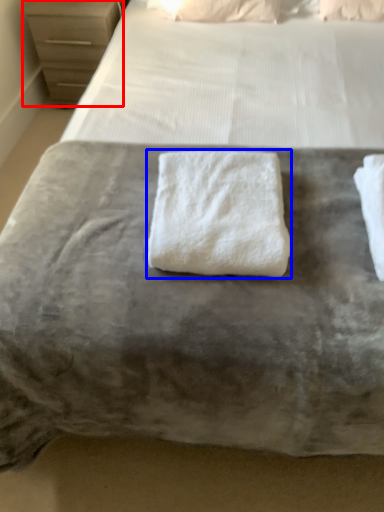
Question: Which of the following is the closest to the observer, chest of drawers (highlighted by a red box) or towel (highlighted by a blue box)?

Choices:
 (A) chest of drawers
 (B) towel

Answer: (B)